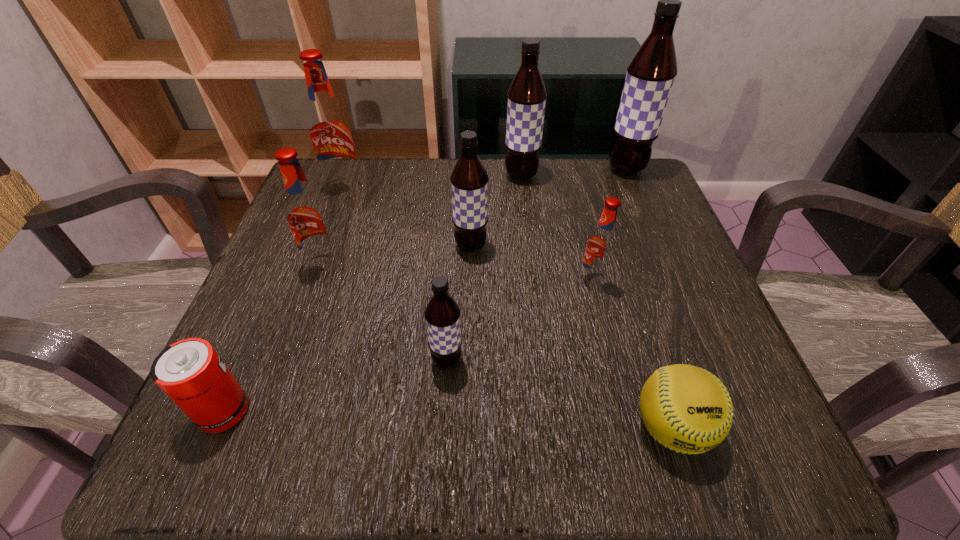
What are the coordinates of `the rightmost brown root beer` in the screenshot? It's located at (650, 75).

Locate an element on the screen. the rightmost root beer is located at coordinates (650, 75).

The width and height of the screenshot is (960, 540). Find the location of `the second biggest brown root beer`. the second biggest brown root beer is located at coordinates (527, 94).

The height and width of the screenshot is (540, 960). In order to click on the fifth root beer from left to right in this screenshot , I will do `click(527, 94)`.

Locate an element on the screen. the biggest red root beer is located at coordinates (329, 129).

Where is `the third biggest brown root beer`? The width and height of the screenshot is (960, 540). the third biggest brown root beer is located at coordinates (469, 180).

Where is `the second smallest red root beer`? the second smallest red root beer is located at coordinates (307, 217).

Locate an element on the screen. the rightmost red root beer is located at coordinates (601, 246).

The height and width of the screenshot is (540, 960). In order to click on the sixth root beer from left to right in this screenshot , I will do `click(601, 246)`.

I want to click on the nearest brown root beer, so click(x=442, y=313).